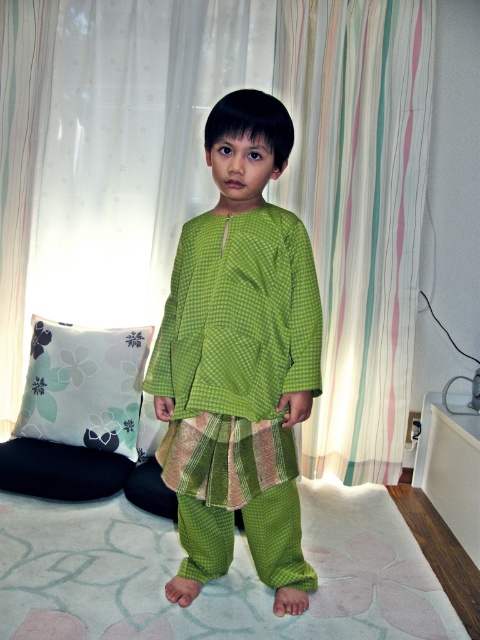
The height and width of the screenshot is (640, 480). Find the location of `green checkered outfit at center`. green checkered outfit at center is located at coordinates (240, 358).

What do you see at coordinates (240, 358) in the screenshot? The width and height of the screenshot is (480, 640). I see `green checkered outfit at center` at bounding box center [240, 358].

Does point (187, 490) lie behind point (289, 45)?

No, (187, 490) is in front of (289, 45).

This screenshot has height=640, width=480. I want to click on green checkered outfit at center, so click(240, 358).

Does striped fabric curtain at upper center have a smaller size compared to white fabric pillow at lower left?

No, striped fabric curtain at upper center is not smaller than white fabric pillow at lower left.

Does point (370, 220) come farther from viewer compared to point (81, 442)?

Yes, it is behind point (81, 442).

Which is in front, point (336, 6) or point (131, 420)?

Point (131, 420) is more forward.

Locate an element on the screen. The height and width of the screenshot is (640, 480). striped fabric curtain at upper center is located at coordinates (359, 209).

Between point (286, 88) and point (108, 344), which one is positioned in front?

Point (108, 344) is in front.

Does striped fabric curtain at right appear under white fabric pillow at lower left?

Incorrect, striped fabric curtain at right is not positioned below white fabric pillow at lower left.

Image resolution: width=480 pixels, height=640 pixels. What are the coordinates of `striped fabric curtain at right` in the screenshot? It's located at (359, 211).

Where is `striped fabric curtain at right`? This screenshot has width=480, height=640. striped fabric curtain at right is located at coordinates (359, 211).